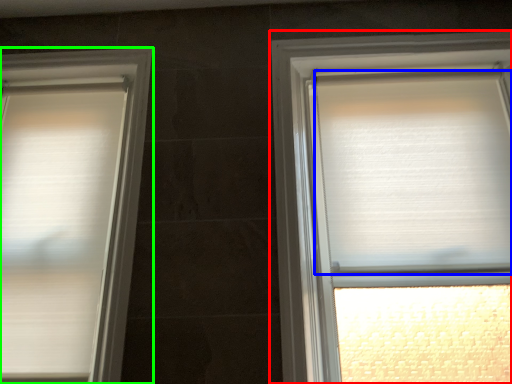
Question: Which object is the farthest from window (highlighted by a red box)? Choose among these: blind (highlighted by a blue box) or window (highlighted by a green box).

Choices:
 (A) blind
 (B) window

Answer: (B)